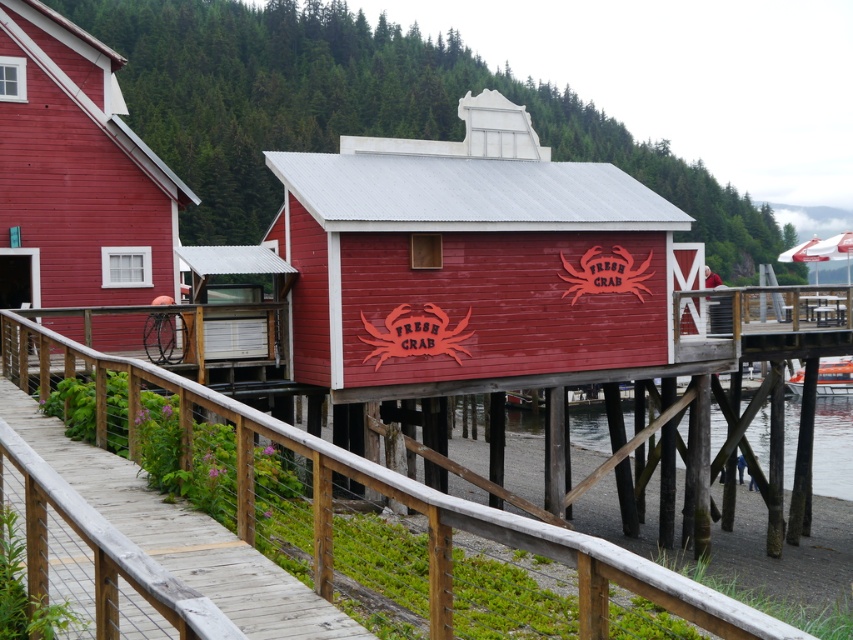
Is wooden at center positioned behind transparent water at lower center?

No, it is not.

Between point (267, 492) and point (758, 442), which one is positioned behind?

Point (758, 442)

Is point (297, 536) positioned behind point (587, 420)?

No, it is in front of (587, 420).

The height and width of the screenshot is (640, 853). I want to click on wooden at center, so click(405, 529).

Which of these two, wooden at center or matte wood hut at center, stands taller?

Standing taller between the two is matte wood hut at center.

Is wooden at center positioned before matte wood hut at center?

That is True.

Which is in front, point (474, 568) or point (9, 205)?

Point (474, 568) is in front.

Find the location of a particular element. wooden at center is located at coordinates (405, 529).

Who is more forward, (x=843, y=460) or (x=840, y=388)?

Positioned in front is point (x=843, y=460).

Who is more forward, (x=836, y=468) or (x=821, y=378)?

Positioned in front is point (x=836, y=468).

Locate an element on the screen. transparent water at lower center is located at coordinates 833,448.